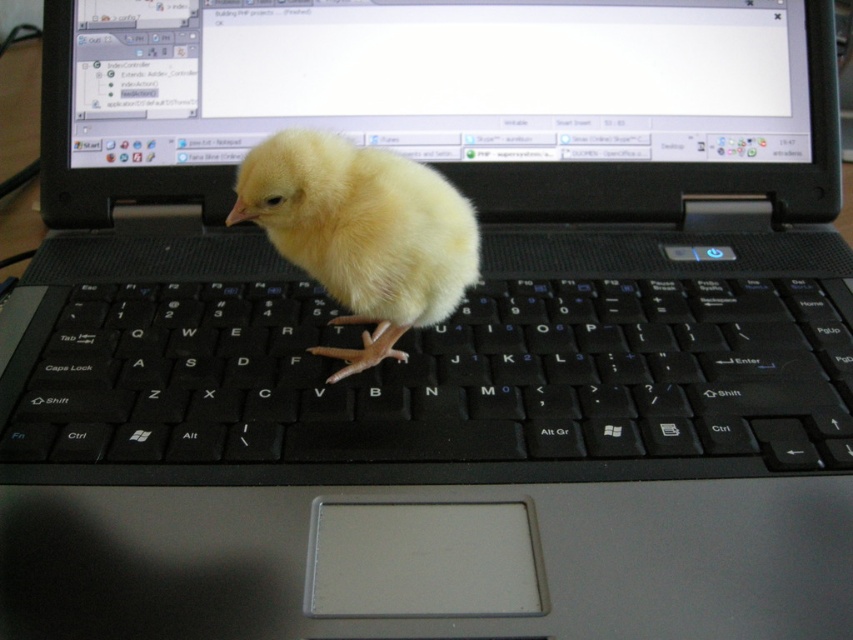
Question: Is black matte keyboard at center thinner than matte plastic screen at upper center?

Choices:
 (A) yes
 (B) no

Answer: (A)

Question: Does black matte keyboard at center appear over yellow fluffy chick at center?

Choices:
 (A) yes
 (B) no

Answer: (B)

Question: Considering the real-world distances, which object is closest to the matte plastic screen at upper center?

Choices:
 (A) black matte keyboard at center
 (B) yellow fluffy chick at center

Answer: (B)

Question: Which of the following is the farthest from the observer?

Choices:
 (A) (399, 438)
 (B) (393, 180)
 (C) (380, 128)

Answer: (C)

Question: Observing the image, what is the correct spatial positioning of black matte keyboard at center in reference to matte plastic screen at upper center?

Choices:
 (A) below
 (B) above

Answer: (A)

Question: Which object is the closest to the yellow fluffy chick at center?

Choices:
 (A) matte plastic screen at upper center
 (B) black matte keyboard at center

Answer: (B)